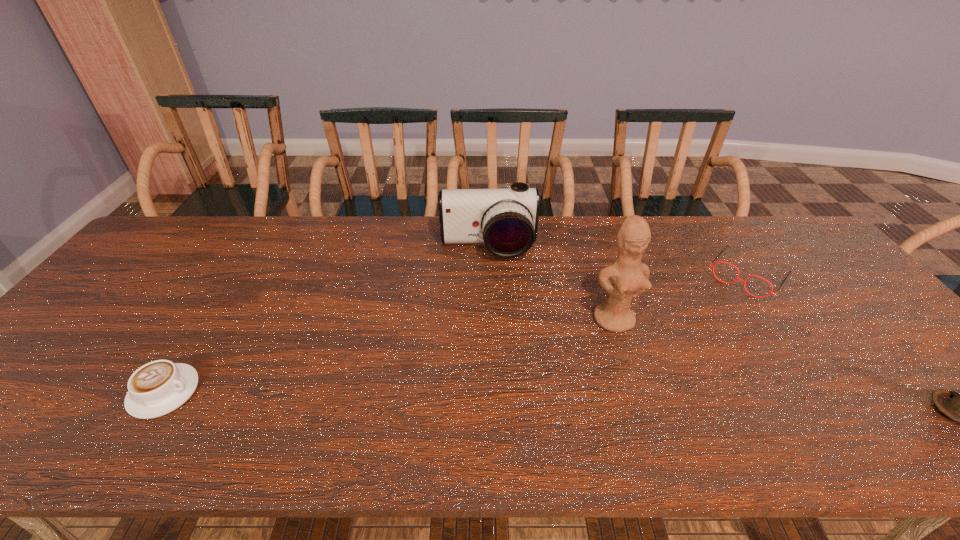
Where is `the leftmost object`? The height and width of the screenshot is (540, 960). the leftmost object is located at coordinates point(159,387).

Image resolution: width=960 pixels, height=540 pixels. Find the location of `the tallest object`. the tallest object is located at coordinates (629, 276).

This screenshot has width=960, height=540. Find the location of `the third farthest object`. the third farthest object is located at coordinates (629, 276).

Image resolution: width=960 pixels, height=540 pixels. I want to click on the second object from left to right, so click(x=506, y=220).

Identify the location of the fourth object from left to right. The width and height of the screenshot is (960, 540). (737, 278).

Locate an element on the screen. The height and width of the screenshot is (540, 960). vacant space situated with the handle on the right side of the cappuccino is located at coordinates (302, 392).

You are a GUI agent. You are given a task and a screenshot of the screen. Output one action in this format:
    pyautogui.click(x=<x>, y=<y>)
    Task: Click on the free space located on the front-facing side of the figurine
    This screenshot has width=960, height=540.
    Given the screenshot: What is the action you would take?
    pyautogui.click(x=635, y=357)

Find the location of a particular element. The image size is (960, 540). free point located 0.220m on the front-facing side of the figurine is located at coordinates (664, 411).

The width and height of the screenshot is (960, 540). I want to click on free space located 0.160m on the front-facing side of the figurine, so click(652, 388).

At what (x,y) coordinates should I click in order to perform the action: click on vacant space located on the surface of the second object from left to right. Please return your answer as a coordinate pair (x, y). The height and width of the screenshot is (540, 960). Looking at the image, I should click on point(494,314).